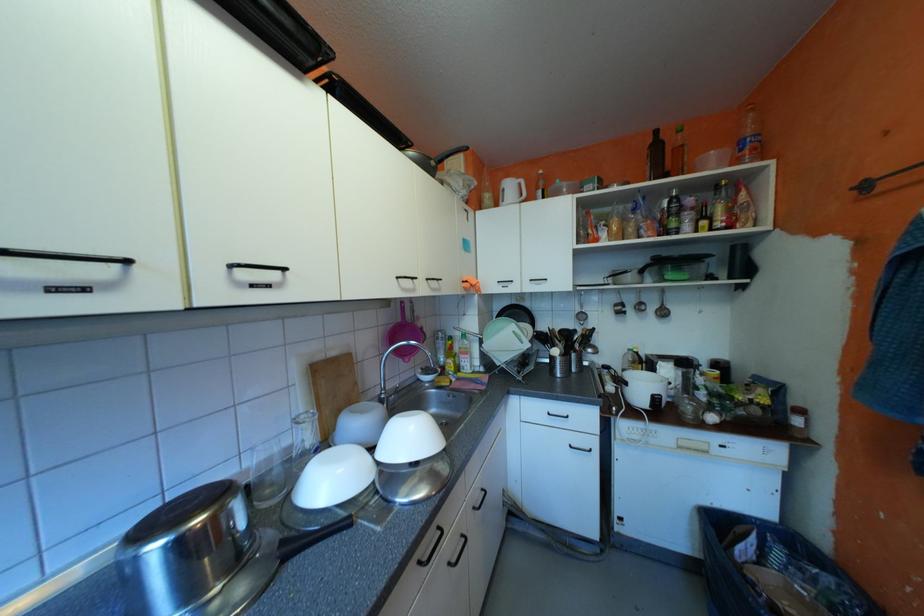
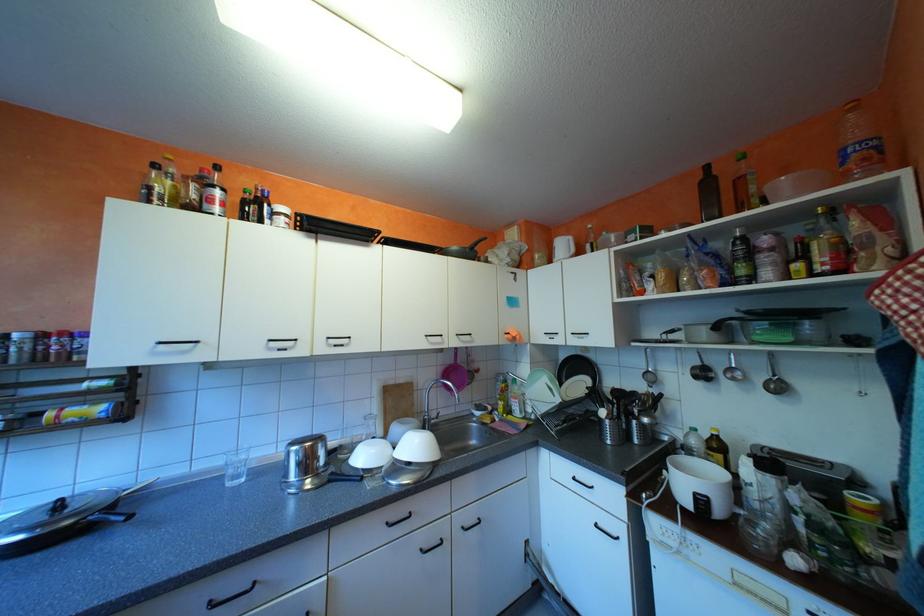
Locate, in the second image, the point that corresponds to [688,363] in the first image.

(771, 464)